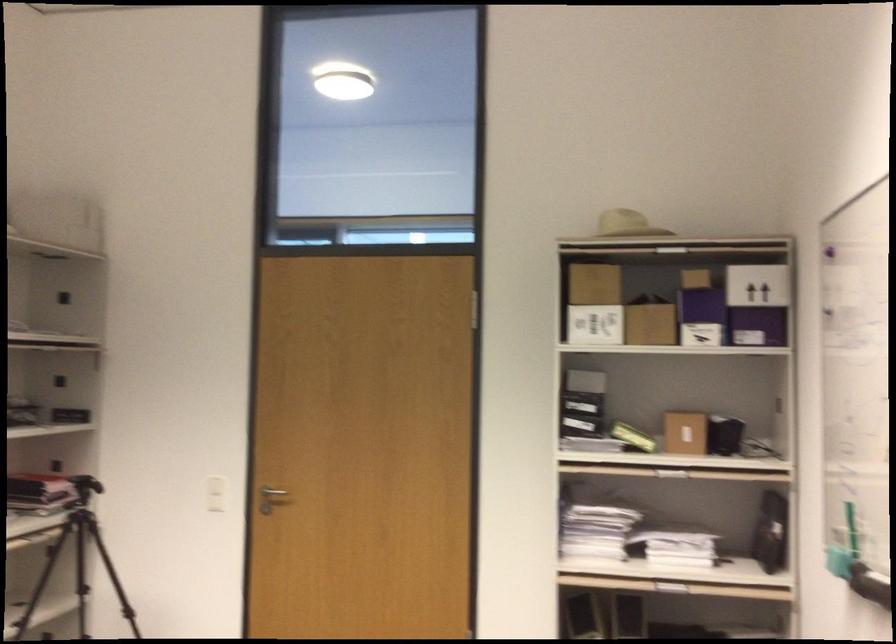
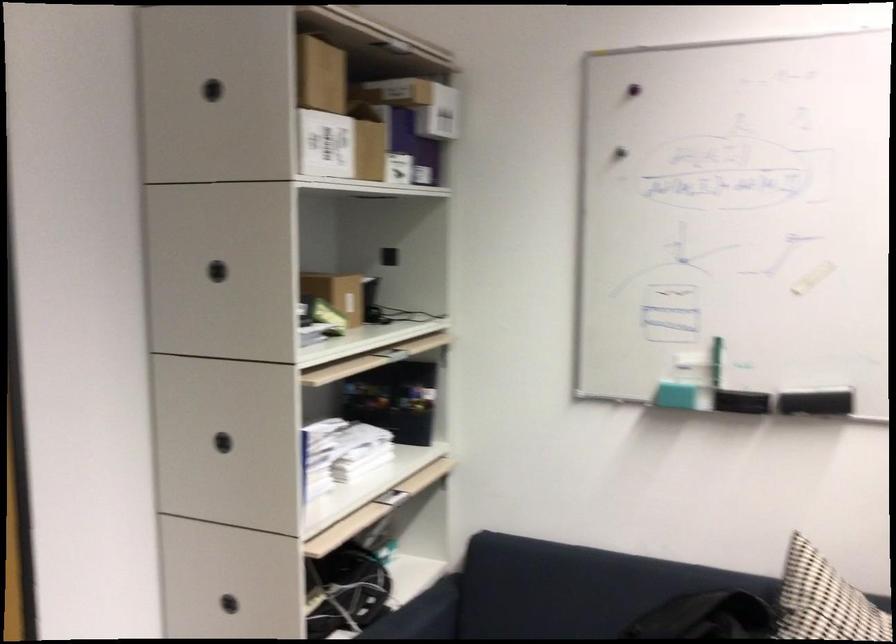
Locate, in the second image, the point that corresponds to the point at 633,319 in the first image.

(340, 146)